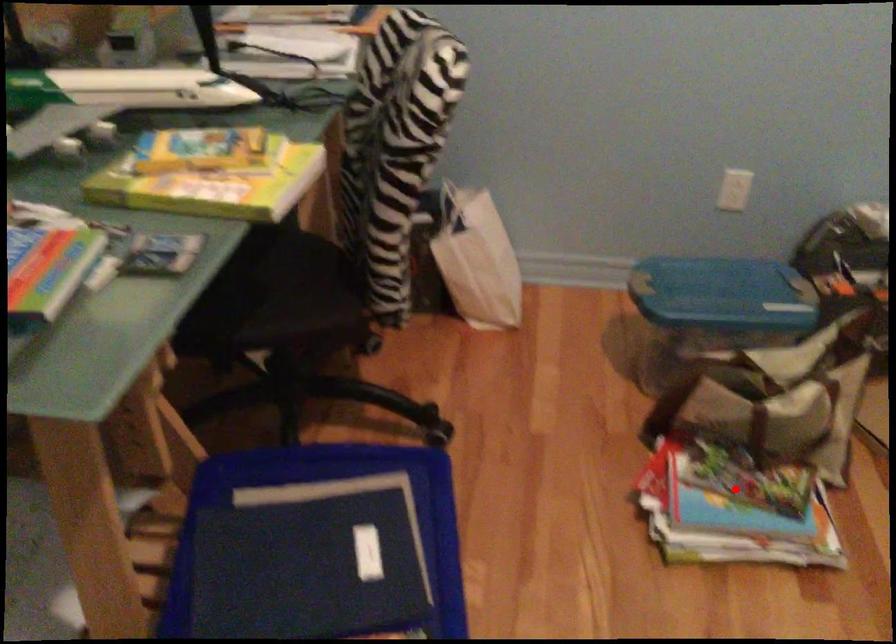
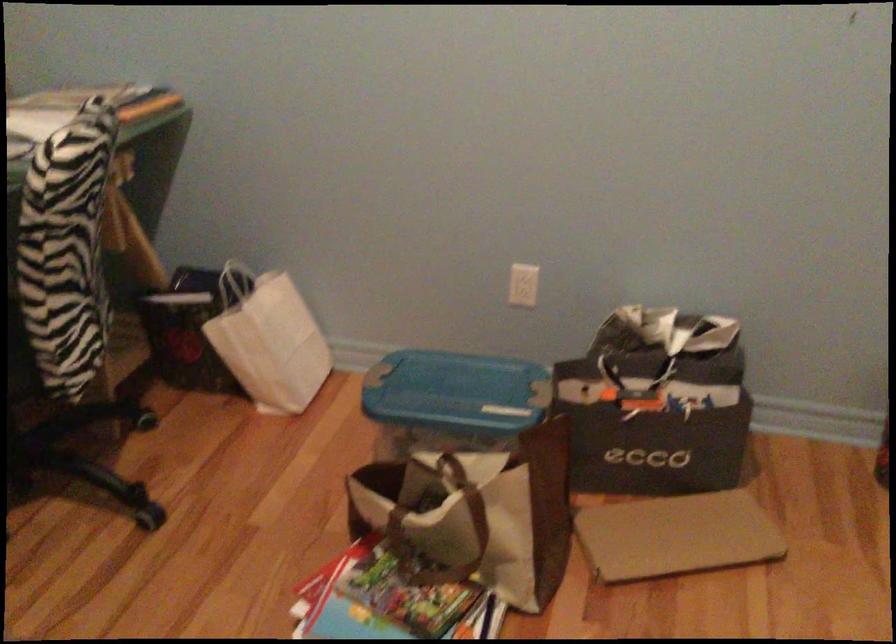
Where in the second image is the point corresponding to the highlighted location from the first image?

(388, 601)